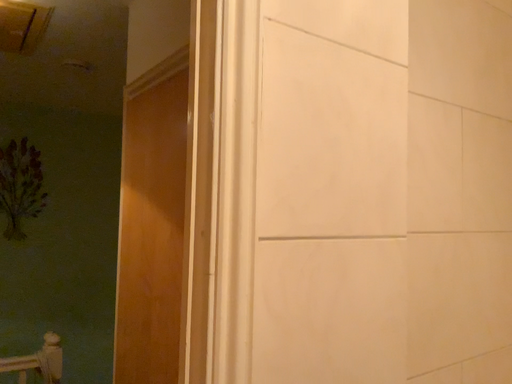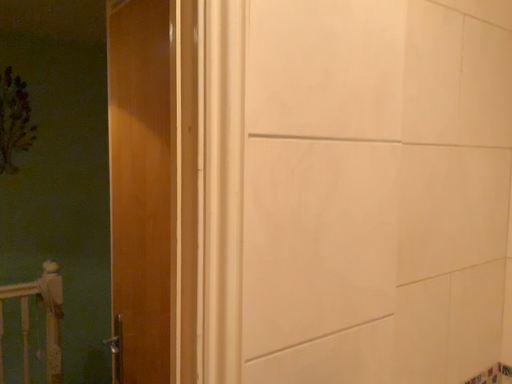
Question: How did the camera likely rotate when shooting the video?

Choices:
 (A) rotated downward
 (B) rotated upward

Answer: (A)